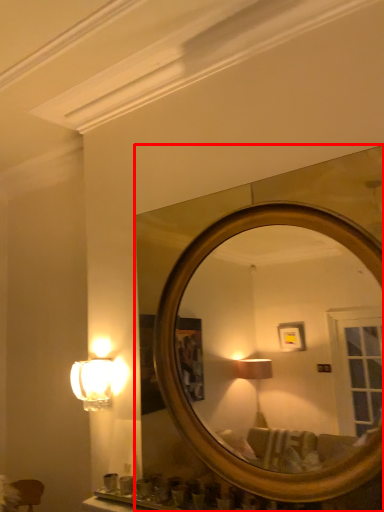
Question: From the image's perspective, considering the relative positions of mirror (annotated by the red box) and lamp in the image provided, where is mirror (annotated by the red box) located with respect to the staircase?

Choices:
 (A) below
 (B) above

Answer: (B)